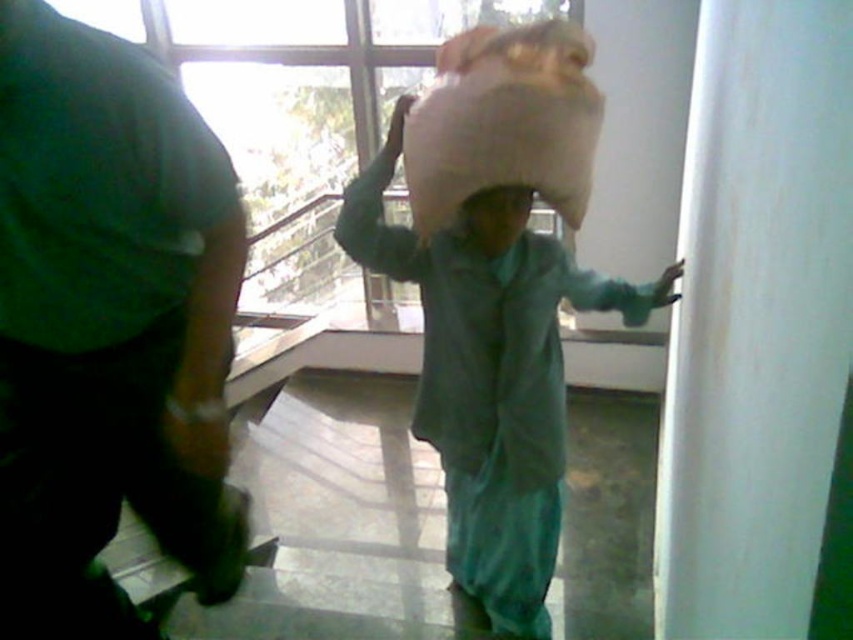
You are an observer in the scene. You see the green matte shirt at left and the beige fabric sack at center. Which object is closer to you?

The green matte shirt at left is closer to you because it is in front of the beige fabric sack at center.

You are standing at point (525, 193) and want to move to point (483, 426). Is the destination point behind you or in front of you?

The destination point (483, 426) is behind you since it is located behind point (525, 193) where you are currently standing.